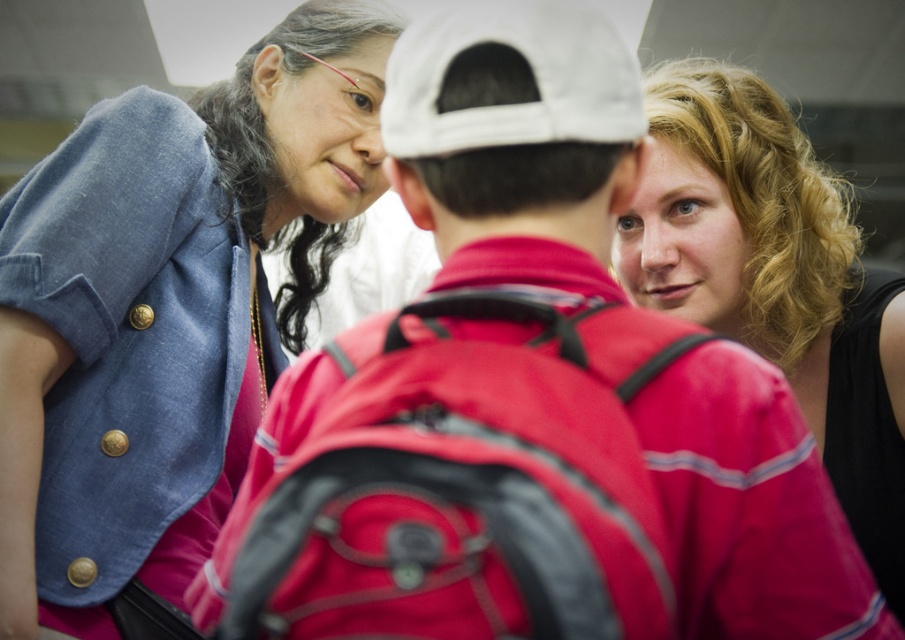
Can you confirm if denim jacket at upper left is positioned to the right of white fabric baseball cap at center?

Incorrect, denim jacket at upper left is not on the right side of white fabric baseball cap at center.

Between denim jacket at upper left and white fabric baseball cap at center, which one appears on the right side from the viewer's perspective?

From the viewer's perspective, white fabric baseball cap at center appears more on the right side.

The image size is (905, 640). What do you see at coordinates (167, 316) in the screenshot?
I see `denim jacket at upper left` at bounding box center [167, 316].

This screenshot has width=905, height=640. Find the location of `denim jacket at upper left`. denim jacket at upper left is located at coordinates (167, 316).

Consider the image. Is blonde curly hair at upper right to the left of white fabric baseball cap at center from the viewer's perspective?

Incorrect, blonde curly hair at upper right is not on the left side of white fabric baseball cap at center.

Who is positioned more to the right, blonde curly hair at upper right or white fabric baseball cap at center?

From the viewer's perspective, blonde curly hair at upper right appears more on the right side.

Between point (891, 365) and point (434, 92), which one is positioned behind?

Point (891, 365)

Where is `blonde curly hair at upper right`? blonde curly hair at upper right is located at coordinates (775, 280).

Between denim jacket at upper left and blonde curly hair at upper right, which one has less height?

blonde curly hair at upper right

Is denim jacket at upper left positioned before blonde curly hair at upper right?

Yes, denim jacket at upper left is closer to the viewer.

Is point (205, 160) farther from camera compared to point (754, 154)?

That is False.

Where is `denim jacket at upper left`? denim jacket at upper left is located at coordinates (167, 316).